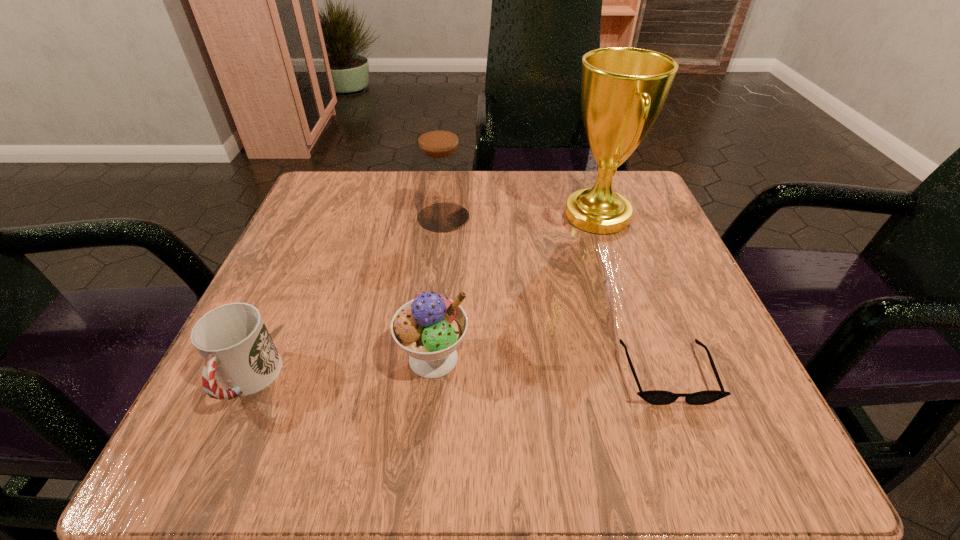
Identify the location of award. (623, 89).

Identify the location of the second tallest object. The image size is (960, 540). (440, 173).

Find the location of `the third tallest object`. the third tallest object is located at coordinates coord(429,328).

You are a GUI agent. You are given a task and a screenshot of the screen. Output one action in this format:
    pyautogui.click(x=<x>, y=<y>)
    Task: Click on the leftmost object
    The height and width of the screenshot is (540, 960).
    Given the screenshot: What is the action you would take?
    pyautogui.click(x=233, y=341)

You are a GUI agent. You are given a task and a screenshot of the screen. Output one action in this format:
    pyautogui.click(x=<x>, y=<y>)
    Task: Click on the second shortest object
    The height and width of the screenshot is (540, 960).
    Given the screenshot: What is the action you would take?
    point(233,341)

I want to click on the shortest object, so click(x=656, y=397).

I want to click on free space located 0.170m by the handles of the tallest object, so click(x=478, y=215).

Locate an element on the screen. This screenshot has width=960, height=540. vacant space located 0.210m by the handles of the tallest object is located at coordinates (458, 215).

I want to click on vacant space located by the handles of the tallest object, so click(x=380, y=215).

Locate an element on the screen. blank area located 0.120m on the back of the fourth shortest object is located at coordinates (448, 174).